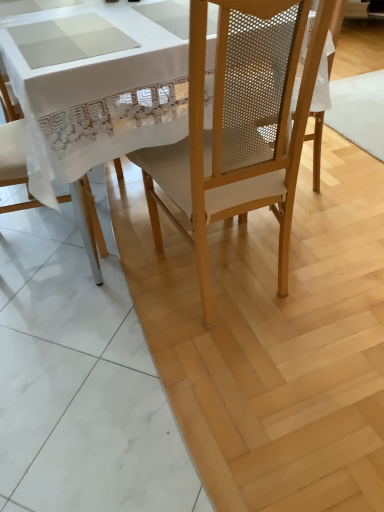
Where is `vacant area situated below white fabric chair at left, which ranks as the first chair in left-to-right order (from a real-world perspective)`? Image resolution: width=384 pixels, height=512 pixels. vacant area situated below white fabric chair at left, which ranks as the first chair in left-to-right order (from a real-world perspective) is located at coordinates (32, 241).